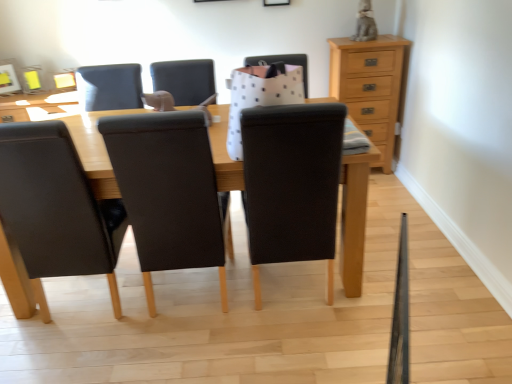
Question: From a real-world perspective, is light brown wood chest of drawers at upper right located beneath black fabric chair at center, positioned as the first chair in right-to-left order?

Choices:
 (A) no
 (B) yes

Answer: (B)

Question: Can you confirm if light brown wood chest of drawers at upper right is smaller than black fabric chair at center, positioned as the first chair in right-to-left order?

Choices:
 (A) yes
 (B) no

Answer: (A)

Question: Is light brown wood chest of drawers at upper right turned away from black fabric chair at center, which ranks as the third chair in left-to-right order?

Choices:
 (A) yes
 (B) no

Answer: (B)

Question: Is light brown wood chest of drawers at upper right surrounding black fabric chair at center, which ranks as the third chair in left-to-right order?

Choices:
 (A) no
 (B) yes

Answer: (A)

Question: From the image's perspective, is light brown wood chest of drawers at upper right located beneath black fabric chair at center, which ranks as the third chair in left-to-right order?

Choices:
 (A) no
 (B) yes

Answer: (A)

Question: Is leather at left, the 1th chair from the left, wider or thinner than leather at center, positioned as the 2th chair in right-to-left order?

Choices:
 (A) thin
 (B) wide

Answer: (B)

Question: Considering the positions of leather at left, the 1th chair from the left, and leather at center, which appears as the second chair when viewed from the left, in the image, is leather at left, the 1th chair from the left, taller or shorter than leather at center, which appears as the second chair when viewed from the left,?

Choices:
 (A) tall
 (B) short

Answer: (A)

Question: Is leather at left, which is the 3th chair in right-to-left order, in front of or behind leather at center, positioned as the 2th chair in right-to-left order, in the image?

Choices:
 (A) front
 (B) behind

Answer: (B)

Question: Considering the relative positions of leather at left, the 1th chair from the left, and leather at center, which appears as the second chair when viewed from the left, in the image provided, is leather at left, the 1th chair from the left, to the left or to the right of leather at center, which appears as the second chair when viewed from the left,?

Choices:
 (A) left
 (B) right

Answer: (A)

Question: Relative to leather at center, which appears as the second chair when viewed from the left, is black fabric chair at center, positioned as the first chair in right-to-left order, in front or behind?

Choices:
 (A) behind
 (B) front

Answer: (B)

Question: Based on their sizes in the image, would you say black fabric chair at center, which ranks as the third chair in left-to-right order, is bigger or smaller than leather at center, positioned as the 2th chair in right-to-left order?

Choices:
 (A) small
 (B) big

Answer: (B)

Question: Is black fabric chair at center, positioned as the first chair in right-to-left order, to the left or to the right of leather at center, positioned as the 2th chair in right-to-left order, in the image?

Choices:
 (A) right
 (B) left

Answer: (A)

Question: From the image's perspective, is black fabric chair at center, positioned as the first chair in right-to-left order, located above or below leather at center, positioned as the 2th chair in right-to-left order?

Choices:
 (A) above
 (B) below

Answer: (A)

Question: Relative to black fabric chair at center, positioned as the first chair in right-to-left order, is leather at center, which appears as the second chair when viewed from the left, in front or behind?

Choices:
 (A) front
 (B) behind

Answer: (B)

Question: Based on their sizes in the image, would you say leather at center, positioned as the 2th chair in right-to-left order, is bigger or smaller than black fabric chair at center, which ranks as the third chair in left-to-right order?

Choices:
 (A) small
 (B) big

Answer: (A)